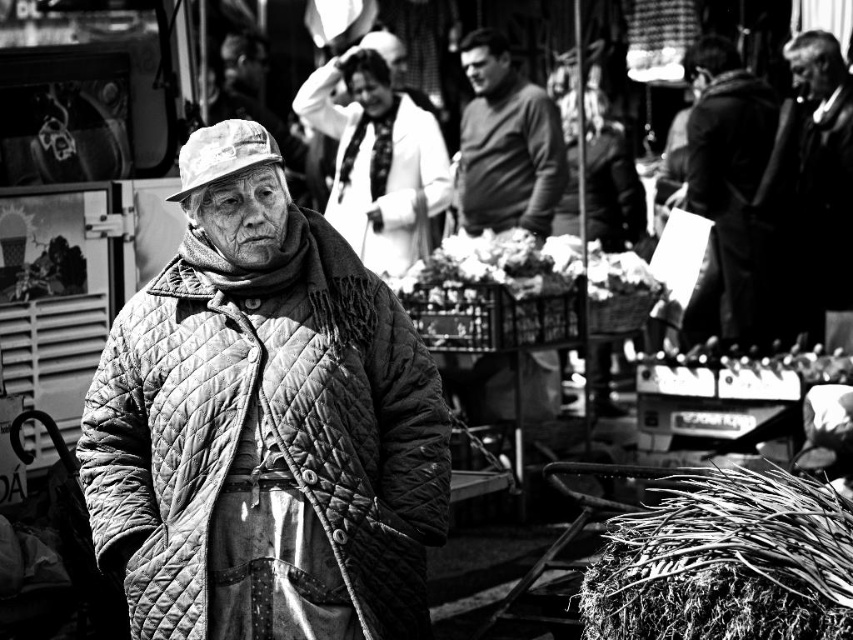
Question: Which object appears farthest from the camera in this image?

Choices:
 (A) quilted fabric coat at left
 (B) white textured coat at center

Answer: (B)

Question: Is quilted fabric coat at left thinner than smooth brown sweater at center?

Choices:
 (A) no
 (B) yes

Answer: (B)

Question: Is smooth black coat at right positioned in front of smooth brown sweater at center?

Choices:
 (A) yes
 (B) no

Answer: (A)

Question: Among these objects, which one is nearest to the camera?

Choices:
 (A) smooth black suit at right
 (B) white fabric hat at center

Answer: (B)

Question: Is smooth black coat at right closer to camera compared to white fabric hat at center?

Choices:
 (A) yes
 (B) no

Answer: (B)

Question: Which point is closer to the camera?

Choices:
 (A) coarse straw hay at lower right
 (B) smooth brown sweater at center

Answer: (A)